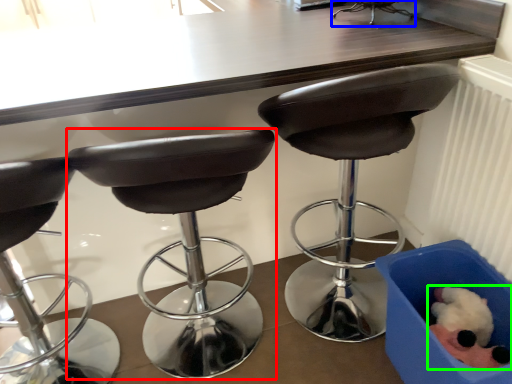
Question: Which object is the farthest from chair (highlighted by a red box)? Choose among these: chair (highlighted by a blue box) or animal (highlighted by a green box).

Choices:
 (A) chair
 (B) animal

Answer: (A)